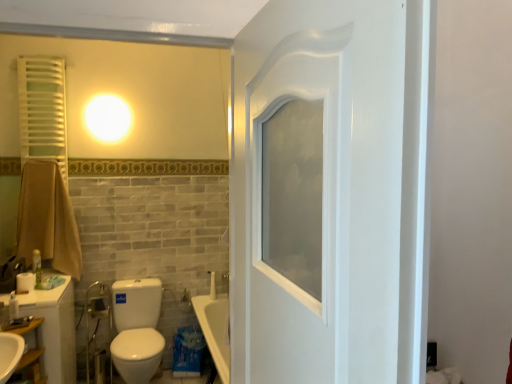
The height and width of the screenshot is (384, 512). I want to click on white glossy toilet at lower left, so click(137, 329).

Locate an element on the screen. The image size is (512, 384). wooden shelf at lower left is located at coordinates (32, 352).

What do you see at coordinates (97, 330) in the screenshot? Image resolution: width=512 pixels, height=384 pixels. I see `metallic chrome faucet at lower left` at bounding box center [97, 330].

I want to click on white matte radiator at upper left, so click(x=42, y=109).

From the image's perspective, does white glossy door at center appear lower than wooden shelf at lower left?

Actually, white glossy door at center appears above wooden shelf at lower left in the image.

From the picture: Between white glossy door at center and wooden shelf at lower left, which one has less height?

With less height is wooden shelf at lower left.

The image size is (512, 384). Find the location of `door on the right of wooden shelf at lower left`. door on the right of wooden shelf at lower left is located at coordinates (324, 191).

Considering the sizes of objects white glossy door at center and wooden shelf at lower left in the image provided, who is wider, white glossy door at center or wooden shelf at lower left?

wooden shelf at lower left.

Is white glossy toilet at lower left further to the viewer compared to white glossy door at center?

Yes, white glossy toilet at lower left is further from the viewer.

Would you say white glossy toilet at lower left is to the left or to the right of white glossy door at center in the picture?

white glossy toilet at lower left is positioned on white glossy door at center's left side.

Does white glossy toilet at lower left turn towards white glossy door at center?

Yes, white glossy toilet at lower left is aimed at white glossy door at center.

Looking at this image, between white glossy toilet at lower left and white glossy door at center, which one has smaller width?

white glossy door at center is thinner.

Is green matte bottle at left completely or partially outside of white glossy toilet at lower left?

Yes, green matte bottle at left is not within white glossy toilet at lower left.

Can you confirm if green matte bottle at left is bigger than white glossy toilet at lower left?

Actually, green matte bottle at left might be smaller than white glossy toilet at lower left.

Consider the image. Can you confirm if green matte bottle at left is thinner than white glossy toilet at lower left?

Correct, the width of green matte bottle at left is less than that of white glossy toilet at lower left.

Which is behind, point (40, 256) or point (136, 313)?

Point (136, 313)

Can you confirm if white glossy door at center is thinner than metallic chrome faucet at lower left?

Yes, white glossy door at center is thinner than metallic chrome faucet at lower left.

Considering the relative sizes of white glossy door at center and metallic chrome faucet at lower left in the image provided, is white glossy door at center taller than metallic chrome faucet at lower left?

Yes.

Is white matte toilet paper at lower left far away from wooden shelf at lower left?

No, white matte toilet paper at lower left is not far away from wooden shelf at lower left.

Is white matte toilet paper at lower left facing towards wooden shelf at lower left?

No.

The height and width of the screenshot is (384, 512). I want to click on shelf on the right of white matte toilet paper at lower left, so click(x=32, y=352).

Considering the relative positions of white matte toilet paper at lower left and wooden shelf at lower left in the image provided, is white matte toilet paper at lower left to the right of wooden shelf at lower left from the viewer's perspective?

Incorrect, white matte toilet paper at lower left is not on the right side of wooden shelf at lower left.

From a real-world perspective, is white matte radiator at upper left positioned above or below metallic chrome faucet at lower left?

Clearly, from a real-world perspective, white matte radiator at upper left is above metallic chrome faucet at lower left.

Which point is more forward, (x=22, y=140) or (x=105, y=303)?

The point (x=22, y=140) is closer to the camera.

Is white matte radiator at upper left inside or outside of metallic chrome faucet at lower left?

white matte radiator at upper left is spatially situated outside metallic chrome faucet at lower left.

Is white matte radiator at upper left placed right next to metallic chrome faucet at lower left?

No, white matte radiator at upper left is not in contact with metallic chrome faucet at lower left.

Locate an element on the screen. The height and width of the screenshot is (384, 512). door located underneath the white matte radiator at upper left (from a real-world perspective) is located at coordinates (324, 191).

Which is in front, point (268, 81) or point (37, 133)?

The point (268, 81) is more forward.

Identify the location of door on the right side of wooden shelf at lower left. The height and width of the screenshot is (384, 512). (324, 191).

Locate an element on the screen. This screenshot has width=512, height=384. toilet on the left of white glossy door at center is located at coordinates (137, 329).

Which object lies nearer to the anchor point white matte radiator at upper left, brown cotton towel at left or white glossy door at center?

Based on the image, brown cotton towel at left appears to be nearer to white matte radiator at upper left.

Estimate the real-world distances between objects in this image. Which object is further from white glossy door at center, white matte toilet paper at lower left or white matte radiator at upper left?

Based on the image, white matte radiator at upper left appears to be further to white glossy door at center.

When comparing their distances from metallic chrome faucet at lower left, does white glossy door at center or brown cotton towel at left seem further?

Based on the image, white glossy door at center appears to be further to metallic chrome faucet at lower left.

Based on their spatial positions, is white matte toilet paper at lower left or brown cotton towel at left further from white matte radiator at upper left?

The object further to white matte radiator at upper left is white matte toilet paper at lower left.

Estimate the real-world distances between objects in this image. Which object is further from metallic chrome faucet at lower left, white glossy door at center or white matte toilet paper at lower left?

white glossy door at center is further to metallic chrome faucet at lower left.

When comparing their distances from white glossy door at center, does green matte bottle at left or white matte radiator at upper left seem closer?

green matte bottle at left is positioned closer to the anchor white glossy door at center.

When comparing their distances from white glossy door at center, does white matte radiator at upper left or brown cotton towel at left seem closer?

Among the two, brown cotton towel at left is located nearer to white glossy door at center.

Which object lies further to the anchor point metallic chrome faucet at lower left, green matte bottle at left or white matte toilet paper at lower left?

Among the two, white matte toilet paper at lower left is located further to metallic chrome faucet at lower left.

You are a GUI agent. You are given a task and a screenshot of the screen. Output one action in this format:
    pyautogui.click(x=<x>, y=<y>)
    Task: Click on the plumbing fixture located between white matte toilet paper at lower left and white glossy toilet at lower left in the left-right direction
    The height and width of the screenshot is (384, 512).
    Given the screenshot: What is the action you would take?
    click(x=97, y=330)

In order to click on shelf between white glossy door at center and white glossy toilet at lower left in the front-back direction in this screenshot , I will do `click(32, 352)`.

Find the location of a particular element. Image resolution: width=512 pixels, height=384 pixels. toilet paper between wooden shelf at lower left and green matte bottle at left in the front-back direction is located at coordinates (25, 282).

What are the coordinates of `shelf between white matte toilet paper at lower left and white glossy toilet at lower left in the horizontal direction` in the screenshot? It's located at (32, 352).